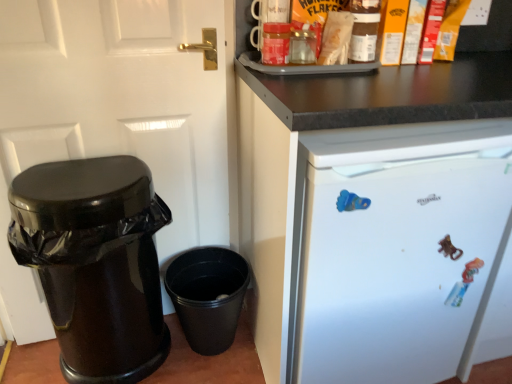
The image size is (512, 384). Describe the element at coordinates (376, 219) in the screenshot. I see `white matte refrigerator at upper right` at that location.

Image resolution: width=512 pixels, height=384 pixels. I want to click on white matte refrigerator at upper right, so click(376, 219).

Considering the positions of objects white matte refrigerator at upper right and glossy plastic trash can at left in the image provided, who is more to the left, white matte refrigerator at upper right or glossy plastic trash can at left?

glossy plastic trash can at left.

Looking at their sizes, would you say white matte refrigerator at upper right is wider or thinner than glossy plastic trash can at left?

Considering their sizes, white matte refrigerator at upper right looks broader than glossy plastic trash can at left.

Is white matte refrigerator at upper right positioned with its back to glossy plastic trash can at left?

No, white matte refrigerator at upper right's orientation is not away from glossy plastic trash can at left.

From the image's perspective, which is above, white matte refrigerator at upper right or glossy plastic trash can at left?

white matte refrigerator at upper right appears higher in the image.

Considering the relative sizes of black plastic bucket at lower center and white glossy door at left in the image provided, is black plastic bucket at lower center shorter than white glossy door at left?

Yes, black plastic bucket at lower center is shorter than white glossy door at left.

Is black plastic bucket at lower center to the left or to the right of white glossy door at left in the image?

Based on their positions, black plastic bucket at lower center is located to the right of white glossy door at left.

From a real-world perspective, is black plastic bucket at lower center below white glossy door at left?

Indeed, from a real-world perspective, black plastic bucket at lower center is positioned beneath white glossy door at left.

Is black plastic bucket at lower center spatially inside white glossy door at left, or outside of it?

The correct answer is: outside.

From a real-world perspective, is white matte refrigerator at upper right positioned under black plastic bucket at lower center based on gravity?

No, from a real-world perspective, white matte refrigerator at upper right is not below black plastic bucket at lower center.

Is point (312, 375) positioned behind point (245, 289)?

No, (312, 375) is in front of (245, 289).

Which object is closer to the camera, white matte refrigerator at upper right or black plastic bucket at lower center?

Positioned in front is white matte refrigerator at upper right.

Does white matte refrigerator at upper right have a greater width compared to black plastic bucket at lower center?

Indeed, white matte refrigerator at upper right has a greater width compared to black plastic bucket at lower center.

Between white glossy door at left and white matte refrigerator at upper right, which one has less height?

white matte refrigerator at upper right is shorter.

Is white glossy door at left facing away from white matte refrigerator at upper right?

No.

Would you say white glossy door at left is to the left or to the right of white matte refrigerator at upper right in the picture?

white glossy door at left is positioned on white matte refrigerator at upper right's left side.

Which is closer to the camera, (33, 301) or (260, 85)?

Point (260, 85)

From the picture: From a real-world perspective, is white matte refrigerator at upper right physically above matte brown jar at upper center?

Actually, white matte refrigerator at upper right is physically below matte brown jar at upper center in the real world.

Looking at this image, does white matte refrigerator at upper right have a greater height compared to matte brown jar at upper center?

Yes.

Is matte brown jar at upper center inside white matte refrigerator at upper right?

Actually, matte brown jar at upper center is outside white matte refrigerator at upper right.

Is white matte refrigerator at upper right taller than white glossy door at left?

In fact, white matte refrigerator at upper right may be shorter than white glossy door at left.

Could white glossy door at left be considered to be inside white matte refrigerator at upper right?

Actually, white glossy door at left is outside white matte refrigerator at upper right.

Which object is thinner, white matte refrigerator at upper right or white glossy door at left?

white glossy door at left.

Is matte brown jar at upper center oriented away from white glossy door at left?

No, matte brown jar at upper center is not facing away from white glossy door at left.

Which is closer, (373,36) or (90,50)?

Point (373,36).

Can you confirm if matte brown jar at upper center is positioned to the right of white glossy door at left?

Yes, matte brown jar at upper center is to the right of white glossy door at left.

Locate an element on the screen. The image size is (512, 384). waste container behind the white matte refrigerator at upper right is located at coordinates (95, 262).

This screenshot has height=384, width=512. I want to click on crock pot below the white glossy door at left (from a real-world perspective), so click(208, 296).

Based on their spatial positions, is white matte refrigerator at upper right or white glossy door at left closer to glossy plastic trash can at left?

The object closer to glossy plastic trash can at left is white glossy door at left.

When comparing their distances from glossy plastic trash can at left, does black plastic bucket at lower center or matte brown jar at upper center seem further?

Based on the image, matte brown jar at upper center appears to be further to glossy plastic trash can at left.

Looking at the image, which one is located closer to matte brown jar at upper center, white glossy door at left or white matte refrigerator at upper right?

The object closer to matte brown jar at upper center is white matte refrigerator at upper right.

Which object lies further to the anchor point glossy plastic trash can at left, white glossy door at left or black plastic bucket at lower center?

Among the two, black plastic bucket at lower center is located further to glossy plastic trash can at left.

When comparing their distances from black plastic bucket at lower center, does glossy plastic trash can at left or white glossy door at left seem further?

white glossy door at left is further to black plastic bucket at lower center.

Which object lies further to the anchor point glossy plastic trash can at left, white matte refrigerator at upper right or black plastic bucket at lower center?

white matte refrigerator at upper right.

From the picture: Which object lies further to the anchor point white glossy door at left, black plastic bucket at lower center or matte brown jar at upper center?

matte brown jar at upper center is positioned further to the anchor white glossy door at left.

From the picture: Estimate the real-world distances between objects in this image. Which object is further from white glossy door at left, white matte refrigerator at upper right or black plastic bucket at lower center?

white matte refrigerator at upper right is further to white glossy door at left.

What are the coordinates of `door located between glossy plastic trash can at left and matte brown jar at upper center in the left-right direction` in the screenshot? It's located at (113, 115).

Identify the location of waste container between white glossy door at left and black plastic bucket at lower center in the up-down direction. (95, 262).

You are a GUI agent. You are given a task and a screenshot of the screen. Output one action in this format:
    pyautogui.click(x=<x>, y=<y>)
    Task: Click on the cabinetry situated between white glossy door at left and matte brown jar at upper center from left to right
    Image resolution: width=512 pixels, height=384 pixels.
    Given the screenshot: What is the action you would take?
    pyautogui.click(x=376, y=219)

Identify the location of cabinetry between matte brown jar at upper center and black plastic bucket at lower center from top to bottom. (376, 219).